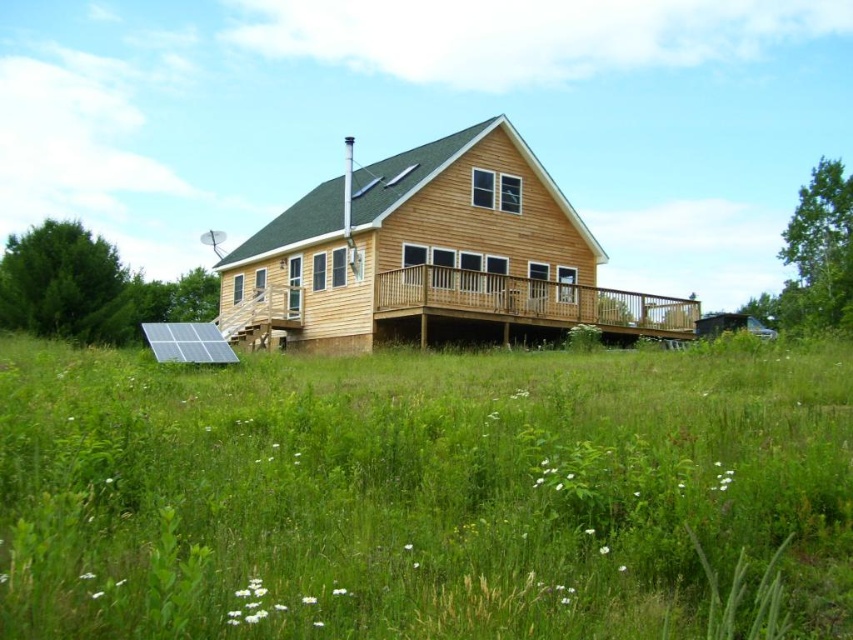
Is point (318, 634) in front of point (463, 305)?

Yes.

Measure the distance between green grass at center and camera.

They are 7.74 feet apart.

Locate an element on the screen. The height and width of the screenshot is (640, 853). green grass at center is located at coordinates (419, 492).